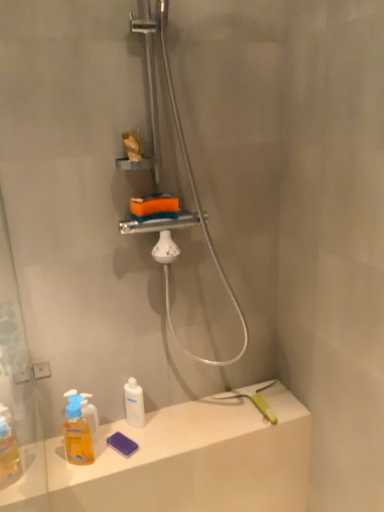
Question: In the image, is translucent plastic mouthwash at lower left, which is the second mouthwash from right to left, positioned in front of or behind matte white counter top at lower left?

Choices:
 (A) front
 (B) behind

Answer: (B)

Question: From the image's perspective, is translucent plastic mouthwash at lower left, arranged as the 2th mouthwash when viewed from the back, positioned above or below matte white counter top at lower left?

Choices:
 (A) below
 (B) above

Answer: (B)

Question: Based on their relative distances, which object is nearer to the matte white counter top at lower left?

Choices:
 (A) metallic silver shower at upper center
 (B) white glossy bottle at lower center, which is counted as the second mouthwash, starting from the left
 (C) translucent plastic mouthwash at lower left, positioned as the 1th mouthwash in left-to-right order

Answer: (B)

Question: Based on their relative distances, which object is nearer to the white glossy bottle at lower center, positioned as the first mouthwash in back-to-front order?

Choices:
 (A) translucent plastic mouthwash at lower left, arranged as the 2th mouthwash when viewed from the back
 (B) metallic silver shower at upper center
 (C) matte white counter top at lower left

Answer: (A)